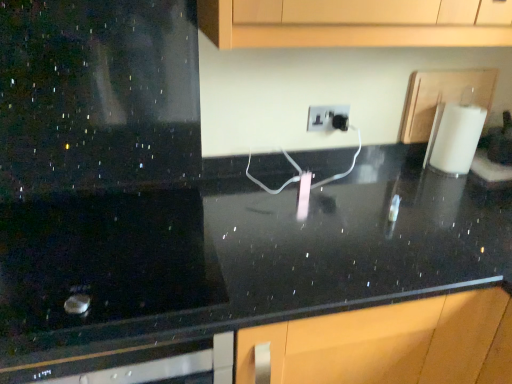
Question: From the image's perspective, is white matte paper towel at right located beneath white plastic electric outlet at center?

Choices:
 (A) no
 (B) yes

Answer: (B)

Question: Does white matte paper towel at right contain white plastic electric outlet at center?

Choices:
 (A) yes
 (B) no

Answer: (B)

Question: Can you confirm if white matte paper towel at right is thinner than white plastic electric outlet at center?

Choices:
 (A) no
 (B) yes

Answer: (A)

Question: From the image's perspective, does white matte paper towel at right appear higher than white plastic electric outlet at center?

Choices:
 (A) yes
 (B) no

Answer: (B)

Question: From a real-world perspective, is white matte paper towel at right located higher than white plastic electric outlet at center?

Choices:
 (A) yes
 (B) no

Answer: (B)

Question: From their relative heights in the image, would you say black polished countertop at center is taller or shorter than white matte paper towel at right?

Choices:
 (A) tall
 (B) short

Answer: (A)

Question: Is black polished countertop at center in front of or behind white matte paper towel at right in the image?

Choices:
 (A) behind
 (B) front

Answer: (B)

Question: Is black polished countertop at center inside or outside of white matte paper towel at right?

Choices:
 (A) outside
 (B) inside

Answer: (A)

Question: Considering the relative positions of black polished countertop at center and white matte paper towel at right in the image provided, is black polished countertop at center to the left or to the right of white matte paper towel at right?

Choices:
 (A) left
 (B) right

Answer: (A)

Question: Does point (196, 241) appear closer or farther from the camera than point (308, 112)?

Choices:
 (A) closer
 (B) farther

Answer: (A)

Question: From a real-world perspective, relative to white plastic electric outlet at center, is black polished countertop at center vertically above or below?

Choices:
 (A) above
 (B) below

Answer: (B)

Question: From the image's perspective, relative to white plastic electric outlet at center, is black polished countertop at center above or below?

Choices:
 (A) above
 (B) below

Answer: (B)

Question: Would you say black polished countertop at center is to the left or to the right of white plastic electric outlet at center in the picture?

Choices:
 (A) right
 (B) left

Answer: (B)

Question: Looking at the image, does white matte paper towel at right seem bigger or smaller compared to black polished countertop at center?

Choices:
 (A) big
 (B) small

Answer: (B)

Question: Is white matte paper towel at right wider or thinner than black polished countertop at center?

Choices:
 (A) wide
 (B) thin

Answer: (B)